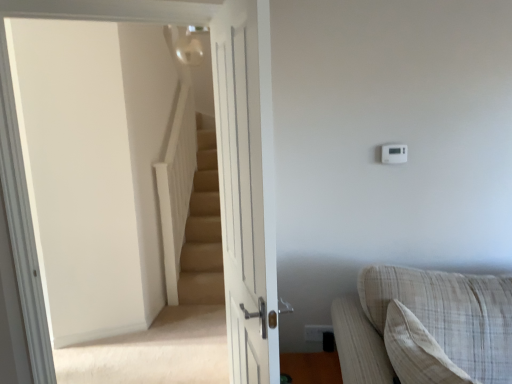
Question: Can you see beige carpeted stairs at upper left touching white plastic thermostat at upper right?

Choices:
 (A) yes
 (B) no

Answer: (B)

Question: Can you confirm if beige carpeted stairs at upper left is smaller than white plastic thermostat at upper right?

Choices:
 (A) no
 (B) yes

Answer: (A)

Question: From a real-world perspective, is beige carpeted stairs at upper left over white plastic thermostat at upper right?

Choices:
 (A) yes
 (B) no

Answer: (B)

Question: Is beige carpeted stairs at upper left thinner than white plastic thermostat at upper right?

Choices:
 (A) yes
 (B) no

Answer: (B)

Question: Considering the relative sizes of beige carpeted stairs at upper left and white plastic thermostat at upper right in the image provided, is beige carpeted stairs at upper left shorter than white plastic thermostat at upper right?

Choices:
 (A) yes
 (B) no

Answer: (B)

Question: Does beige carpeted stairs at upper left appear on the right side of white plastic thermostat at upper right?

Choices:
 (A) no
 (B) yes

Answer: (A)

Question: Would you say white plastic electric outlet at upper right is part of white wooden door at center's contents?

Choices:
 (A) no
 (B) yes

Answer: (A)

Question: Considering the relative sizes of white wooden door at center and white plastic electric outlet at upper right in the image provided, is white wooden door at center bigger than white plastic electric outlet at upper right?

Choices:
 (A) no
 (B) yes

Answer: (B)

Question: From the image's perspective, is white wooden door at center beneath white plastic electric outlet at upper right?

Choices:
 (A) yes
 (B) no

Answer: (B)

Question: Does white wooden door at center lie in front of white plastic electric outlet at upper right?

Choices:
 (A) no
 (B) yes

Answer: (B)

Question: From a real-world perspective, does white wooden door at center sit lower than white plastic electric outlet at upper right?

Choices:
 (A) yes
 (B) no

Answer: (B)

Question: Considering the relative positions of white wooden door at center and white plastic electric outlet at upper right in the image provided, is white wooden door at center to the left of white plastic electric outlet at upper right from the viewer's perspective?

Choices:
 (A) yes
 (B) no

Answer: (A)

Question: Can you confirm if white plastic thermostat at upper right is positioned to the right of white wooden door at center?

Choices:
 (A) yes
 (B) no

Answer: (A)